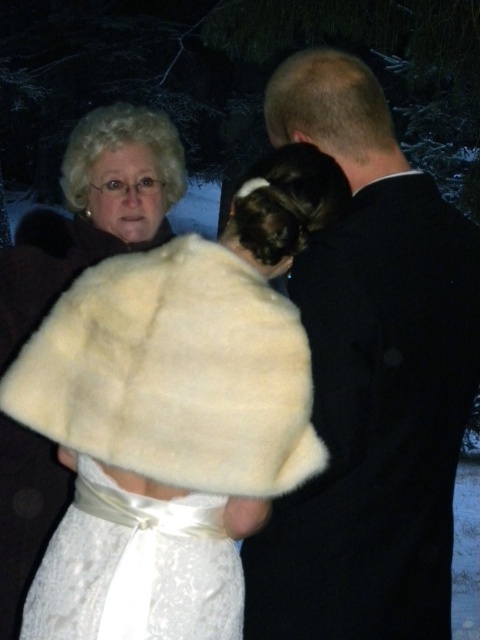
Between black satin suit at center and white fur shawl at upper left, which one has less height?

Standing shorter between the two is white fur shawl at upper left.

Is point (448, 417) farther from camera compared to point (173, 480)?

Yes.

At what (x,y) coordinates should I click in order to perform the action: click on black satin suit at center. Please return your answer as a coordinate pair (x, y). Looking at the image, I should click on (371, 380).

Is black satin suit at center to the right of white satin dress at center from the viewer's perspective?

Indeed, black satin suit at center is positioned on the right side of white satin dress at center.

Does black satin suit at center have a lesser width compared to white satin dress at center?

Incorrect, black satin suit at center's width is not less than white satin dress at center's.

Who is more forward, (419, 387) or (115, 570)?

Point (115, 570) is more forward.

Where is `black satin suit at center`? The height and width of the screenshot is (640, 480). black satin suit at center is located at coordinates (371, 380).

Between white fur shawl at upper left and white satin dress at center, which one appears on the right side from the viewer's perspective?

From the viewer's perspective, white fur shawl at upper left appears more on the right side.

How distant is white fur shawl at upper left from white satin dress at center?

5.93 inches

Is point (264, 280) positioned after point (107, 547)?

No, (264, 280) is closer to viewer.

Where is `white fur shawl at upper left`? This screenshot has height=640, width=480. white fur shawl at upper left is located at coordinates (191, 348).